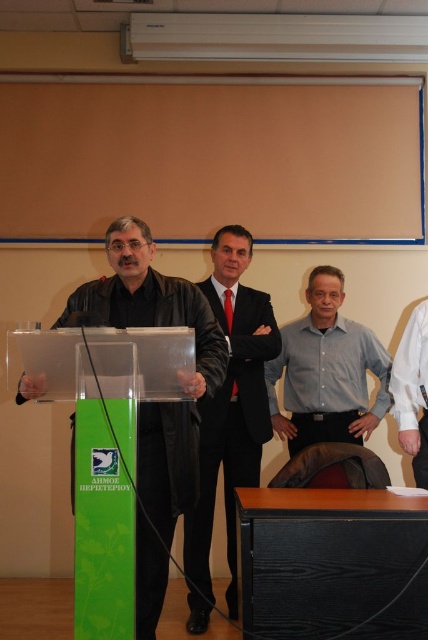
Can you confirm if black suit at center is positioned to the right of light blue shirt at center?

In fact, black suit at center is to the left of light blue shirt at center.

Which is more to the right, black suit at center or light blue shirt at center?

Positioned to the right is light blue shirt at center.

Where is `black suit at center`? black suit at center is located at coordinates (229, 417).

What do you see at coordinates (323, 557) in the screenshot?
I see `green wood podium at center` at bounding box center [323, 557].

Who is positioned more to the left, green wood podium at center or black leather jacket at center?

Positioned to the left is black leather jacket at center.

The image size is (428, 640). In order to click on green wood podium at center in this screenshot , I will do `click(323, 557)`.

Is green wood podium at center to the left of light blue shirt at center from the viewer's perspective?

Correct, you'll find green wood podium at center to the left of light blue shirt at center.

Can you confirm if green wood podium at center is thinner than light blue shirt at center?

Correct, green wood podium at center's width is less than light blue shirt at center's.

Where is `green wood podium at center`? The width and height of the screenshot is (428, 640). green wood podium at center is located at coordinates (323, 557).